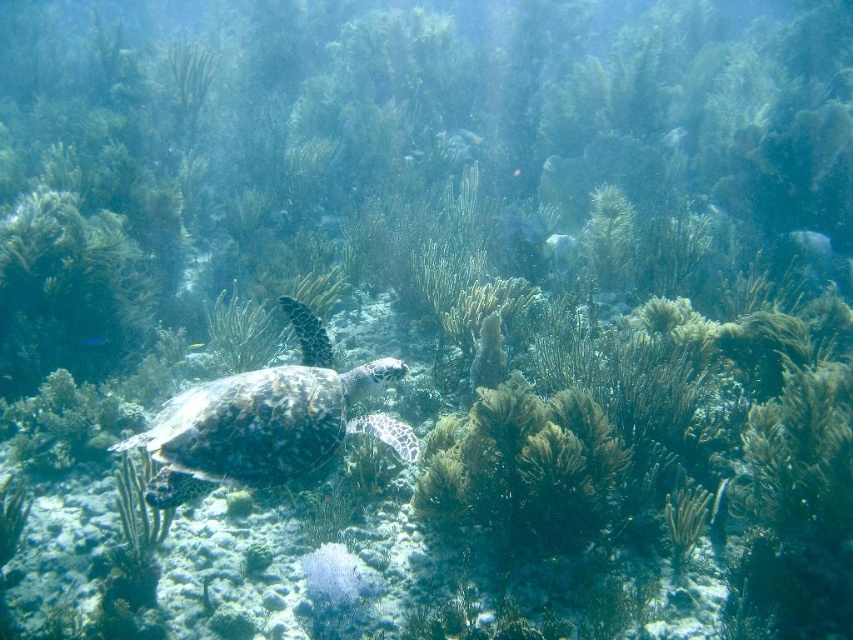
Question: Which is nearer to the smooth gray fish at upper center?

Choices:
 (A) shiny yellow fish at center
 (B) shiny blue fish at center
 (C) shiny silver fish at upper center
 (D) translucent white fish at center

Answer: (D)

Question: Can you confirm if smooth gray fish at upper center is wider than shiny blue fish at center?

Choices:
 (A) no
 (B) yes

Answer: (B)

Question: Which point is farther from the camera taking this photo?

Choices:
 (A) (97, 337)
 (B) (519, 173)
 (C) (241, 474)

Answer: (B)

Question: Does smooth gray fish at upper center have a smaller size compared to translucent white fish at center?

Choices:
 (A) no
 (B) yes

Answer: (A)

Question: Is shiny blue fish at center positioned at the back of shiny yellow fish at center?

Choices:
 (A) no
 (B) yes

Answer: (A)

Question: Among these objects, which one is nearest to the camera?

Choices:
 (A) shiny silver fish at upper center
 (B) shiny blue fish at center

Answer: (B)